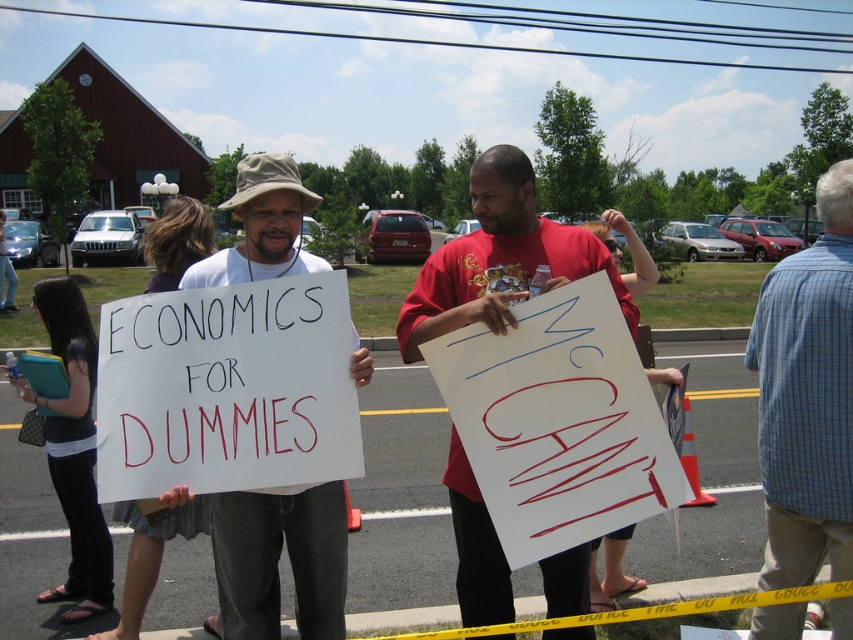
You are a photographer trying to capture a photo of the blue plaid shirt at upper right and the white paper sign at center. Based on their positions, which object should you focus on first to ensure both are in frame?

The blue plaid shirt at upper right is to the right of the white paper sign at center, so you should focus on the white paper sign at center first to ensure both are in frame.

You are a photographer trying to capture a group photo of the blue plaid shirt at upper right and the red cotton shirt at center. Based on their heights, which person should stand in the back to avoid blocking the other?

The blue plaid shirt at upper right is much taller than the red cotton shirt at center, so they should stand in the back to avoid blocking the shorter person.

You are standing in the parking lot and notice two people holding signs. The person on the left is wearing a beige bucket hat and the person on the right is wearing a blue plaid shirt at upper right. Which person is closer to the building with the red roof?

The blue plaid shirt at upper right is located at point (807,397), which is closer to the building with the red roof compared to the person on the left with the beige bucket hat.